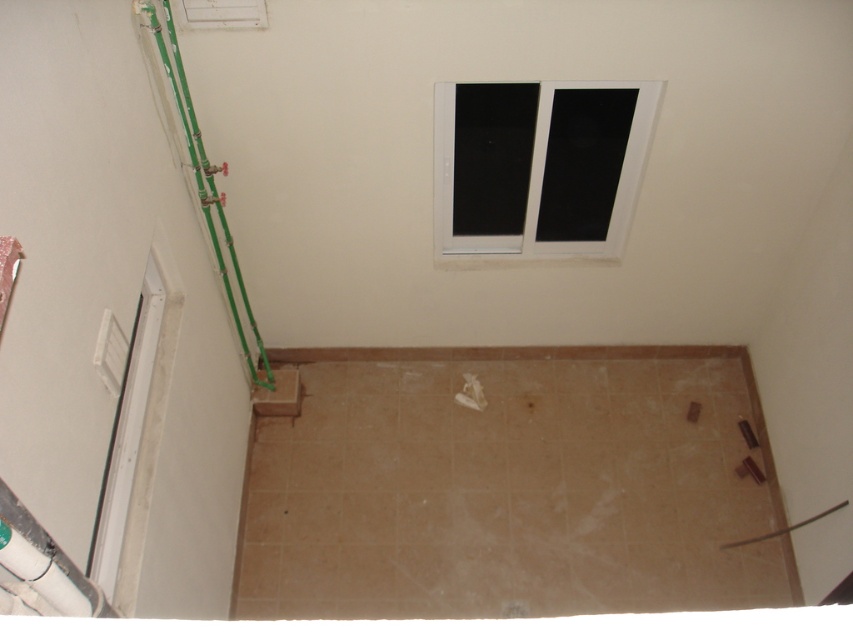
Can you confirm if white plastic window at upper center is thinner than green plastic pipes at left?

In fact, white plastic window at upper center might be wider than green plastic pipes at left.

Who is taller, white plastic window at upper center or green plastic pipes at left?

green plastic pipes at left

Does point (497, 243) lie behind point (199, 192)?

Yes, it is behind point (199, 192).

At what (x,y) coordinates should I click in order to perform the action: click on white plastic window at upper center. Please return your answer as a coordinate pair (x, y). The width and height of the screenshot is (853, 640). Looking at the image, I should click on (538, 164).